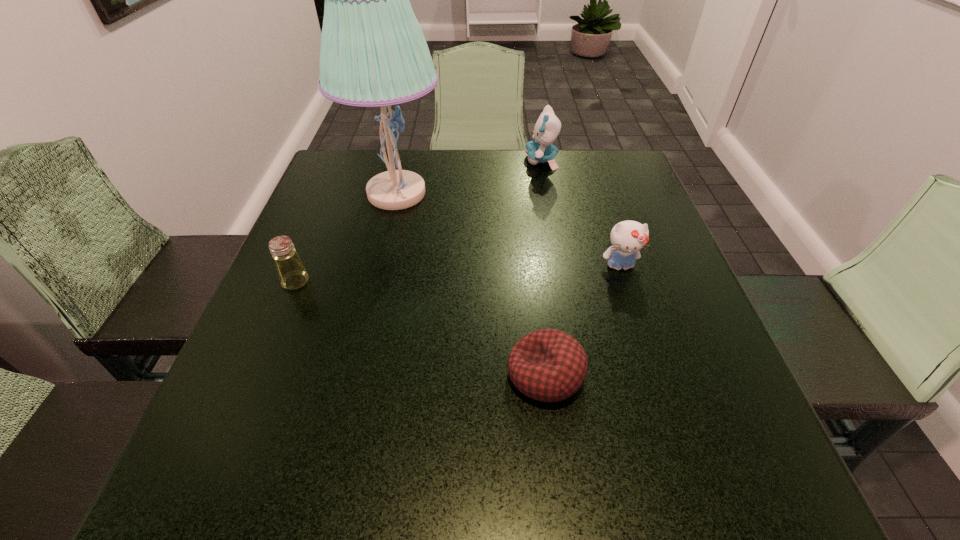
Image resolution: width=960 pixels, height=540 pixels. In order to click on vacant region located on the face of the left kitten in this screenshot , I will do `click(454, 160)`.

Where is `free space located 0.070m on the face of the left kitten`? free space located 0.070m on the face of the left kitten is located at coordinates (500, 160).

You are a GUI agent. You are given a task and a screenshot of the screen. Output one action in this format:
    pyautogui.click(x=<x>, y=<y>)
    Task: Click on the blank space located 0.370m on the face of the left kitten
    
    Given the screenshot: What is the action you would take?
    pyautogui.click(x=394, y=160)

At what (x,y) coordinates should I click in order to perform the action: click on vacant point located 0.290m on the front-facing side of the right kitten. Please return your answer as a coordinate pair (x, y). Image resolution: width=960 pixels, height=540 pixels. Looking at the image, I should click on (664, 404).

This screenshot has width=960, height=540. In order to click on free location located on the front of the leftmost object in this screenshot , I will do `click(235, 428)`.

You are a GUI agent. You are given a task and a screenshot of the screen. Output one action in this format:
    pyautogui.click(x=<x>, y=<y>)
    Task: Click on the free space located 0.180m on the back of the beanbag
    The image size is (960, 540).
    Given the screenshot: What is the action you would take?
    pyautogui.click(x=534, y=274)

Where is `lamp present at the far edge`? Image resolution: width=960 pixels, height=540 pixels. lamp present at the far edge is located at coordinates (373, 52).

Where is `kitten that is at the far edge`? The image size is (960, 540). kitten that is at the far edge is located at coordinates (547, 128).

Locate an element on the screen. This screenshot has height=540, width=960. lamp located in the left edge section of the desktop is located at coordinates (373, 52).

The image size is (960, 540). Find the location of `saltshaker that is at the left edge`. saltshaker that is at the left edge is located at coordinates (292, 274).